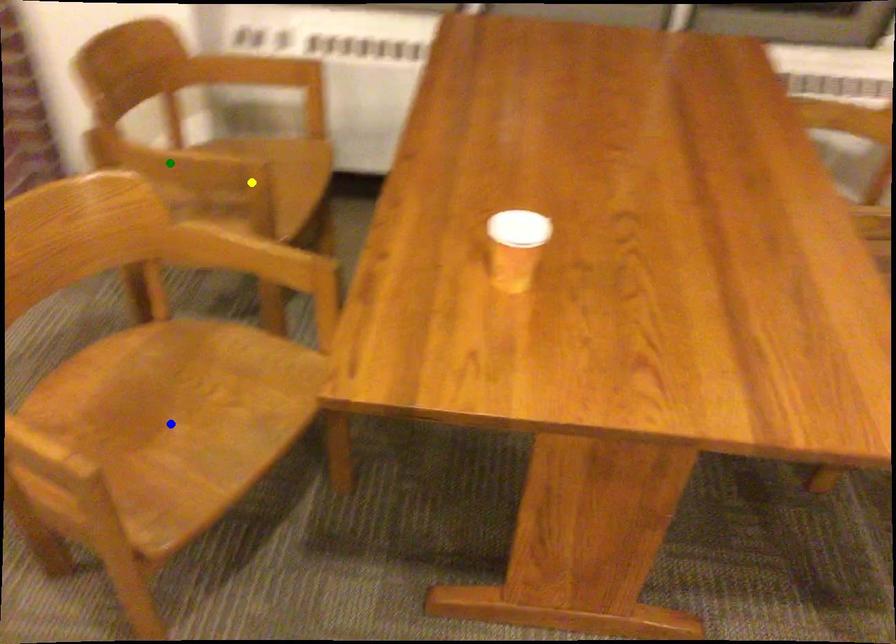
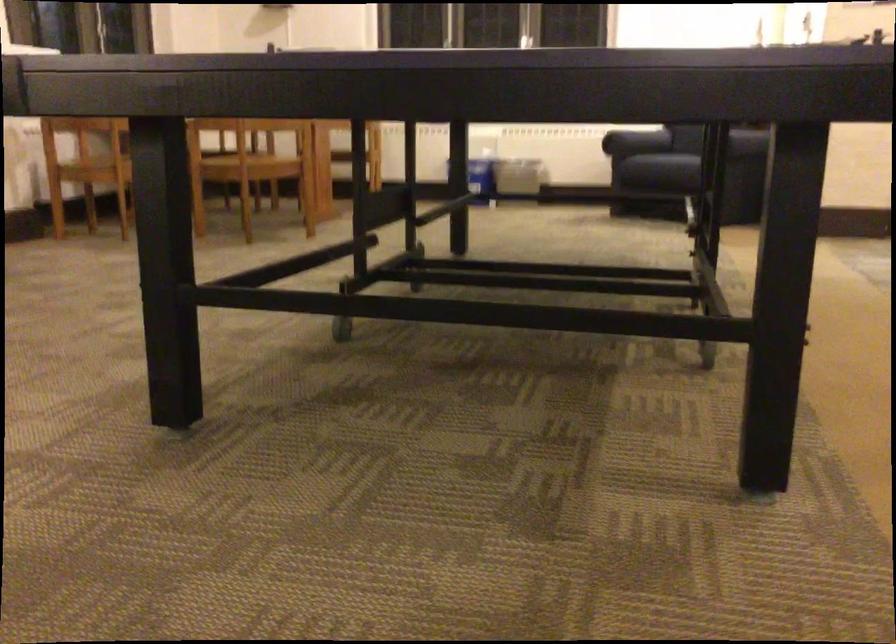
I am providing you with two images of the same scene from different viewpoints. Three points are marked in image1. Which point corresponds to a part or object that is occluded in image2?In image1, three points are marked. Which of them correspond to a part or object that is occluded in image2?Among the three points shown in image1, which one corresponds to a part or object that is no longer visible due to occlusion in image2?

Invisible in image2: blue point, yellow point, green point.